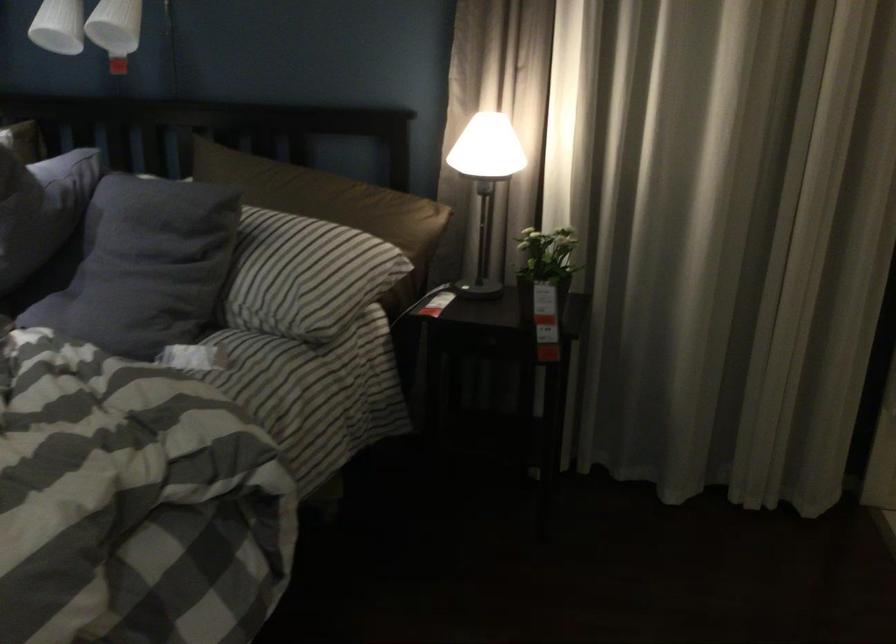
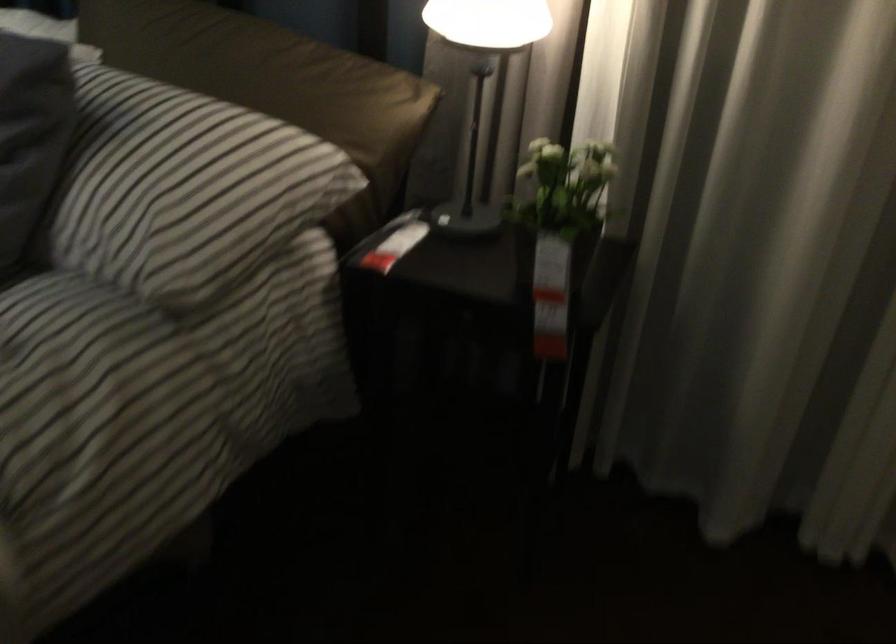
Question: The first image is from the beginning of the video and the second image is from the end. How did the camera likely rotate when shooting the video?

Choices:
 (A) Left
 (B) Right
 (C) Up
 (D) Down

Answer: (D)